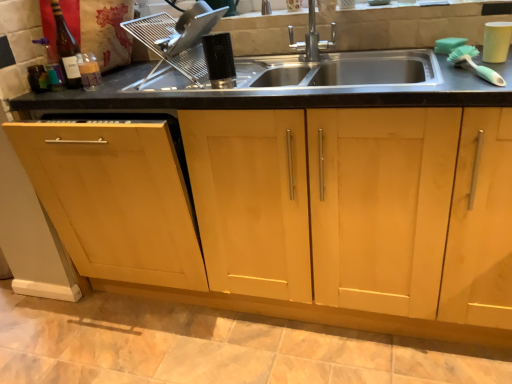
The image size is (512, 384). What are the coordinates of `vacant area in front of translucent glass bottle at upper left` in the screenshot? It's located at (69, 101).